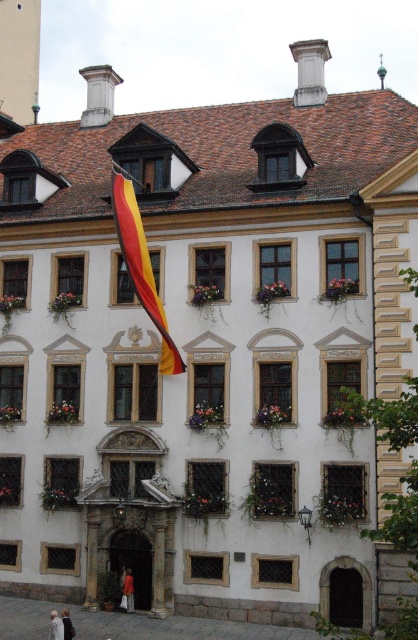
Question: Can you confirm if red fabric flag at upper left is bigger than light beige coat at lower left?

Choices:
 (A) yes
 (B) no

Answer: (B)

Question: Based on their relative distances, which object is farther from the red fabric flag at upper left?

Choices:
 (A) light beige coat at lower left
 (B) yellow-red striped fabric at center

Answer: (B)

Question: Does yellow-red striped fabric at center appear over red fabric flag at upper left?

Choices:
 (A) yes
 (B) no

Answer: (A)

Question: Can you confirm if red fabric flag at upper left is thinner than light beige coat at lower left?

Choices:
 (A) yes
 (B) no

Answer: (A)

Question: Which point is farther to the camera?

Choices:
 (A) (53, 620)
 (B) (129, 580)
 (C) (127, 204)

Answer: (B)

Question: Estimate the real-world distances between objects in this image. Which object is farther from the light beige coat at lower left?

Choices:
 (A) yellow-red striped fabric at center
 (B) red fabric flag at upper left

Answer: (A)